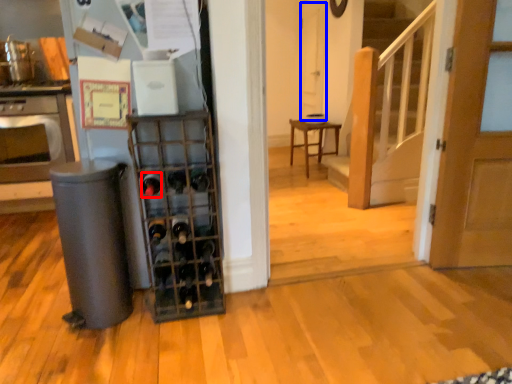
Question: Which object is closer to the camera taking this photo, wine bottle (highlighted by a red box) or screen door (highlighted by a blue box)?

Choices:
 (A) wine bottle
 (B) screen door

Answer: (A)